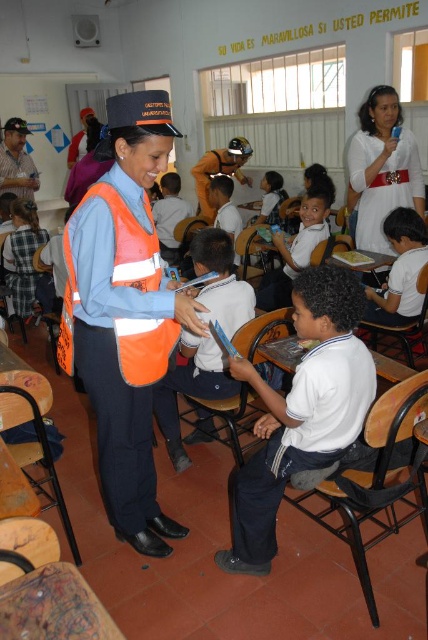
Is white matte shirt at lower right thinner than white cotton shirt at lower left?

Yes.

Can you confirm if white matte shirt at lower right is positioned above white cotton shirt at lower left?

Incorrect, white matte shirt at lower right is not positioned above white cotton shirt at lower left.

This screenshot has height=640, width=428. Find the location of `white matte shirt at lower right`. white matte shirt at lower right is located at coordinates (401, 269).

Locate an element on the screen. white matte shirt at lower right is located at coordinates (401, 269).

Who is lower down, white glossy book at center or white satin dress at upper center?

white glossy book at center

How far apart are white glossy book at center and white satin dress at upper center?

A distance of 1.59 meters exists between white glossy book at center and white satin dress at upper center.

Is point (249, 291) closer to camera compared to point (388, 173)?

Yes, point (249, 291) is closer to viewer.

Locate an element on the screen. white glossy book at center is located at coordinates (190, 388).

Does white smooth shirt at center come behind white satin dress at upper center?

No.

Is point (305, 410) less distant than point (362, 144)?

Yes.

Identify the location of white smooth shirt at center. (300, 412).